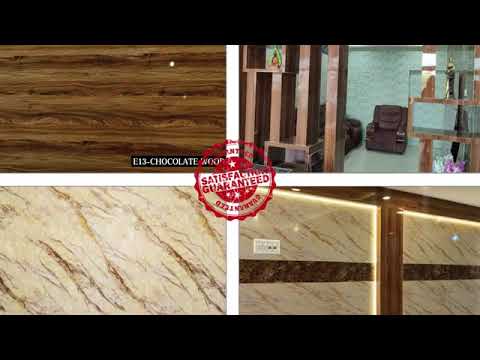
The height and width of the screenshot is (360, 480). Identify the location of area left of light switch. (245, 247).